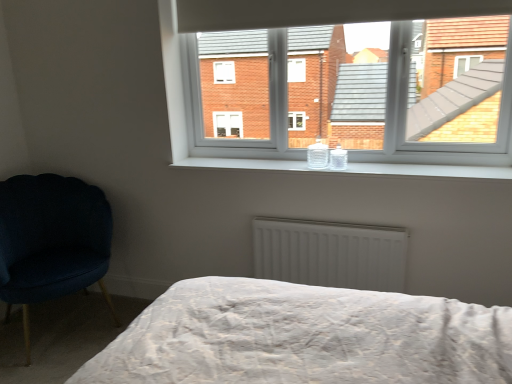
Locate an element on the screen. This screenshot has width=512, height=384. free space above white glossy window sill at center (from a real-world perspective) is located at coordinates (366, 164).